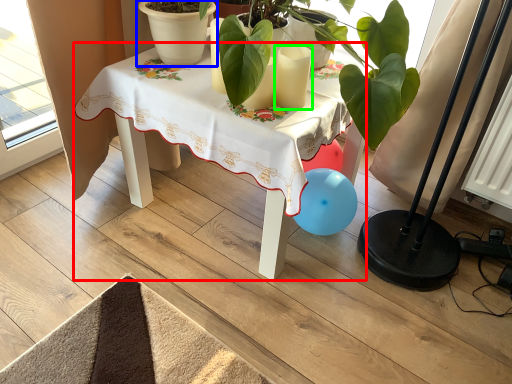
Question: Which object is positioned farthest from table (highlighted by a red box)? Select from flowerpot (highlighted by a blue box) and candle (highlighted by a green box).

Choices:
 (A) flowerpot
 (B) candle

Answer: (B)